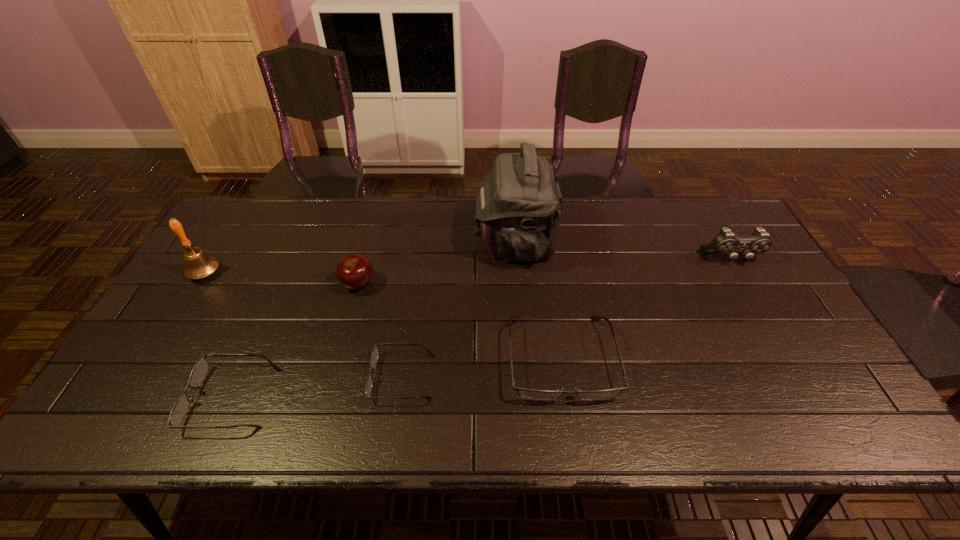
Please point a vacant point for placing a spectacles on the right. Please provide its 2D coordinates. Your answer should be formatted as a tuple, i.e. [(x, y)], where the tuple contains the x and y coordinates of a point satisfying the conditions above.

[(708, 340)]